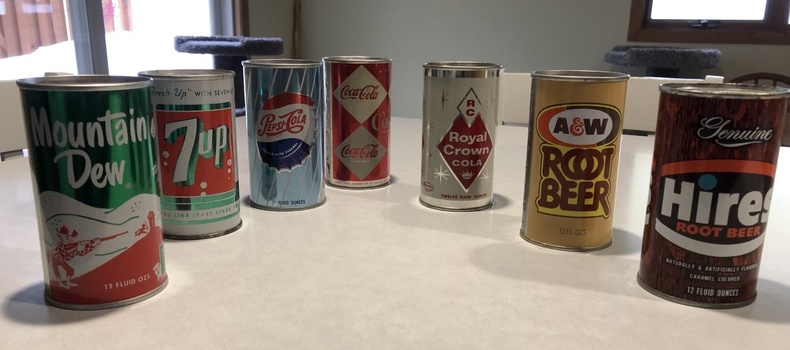
Identify the location of table empty space. (329, 256).